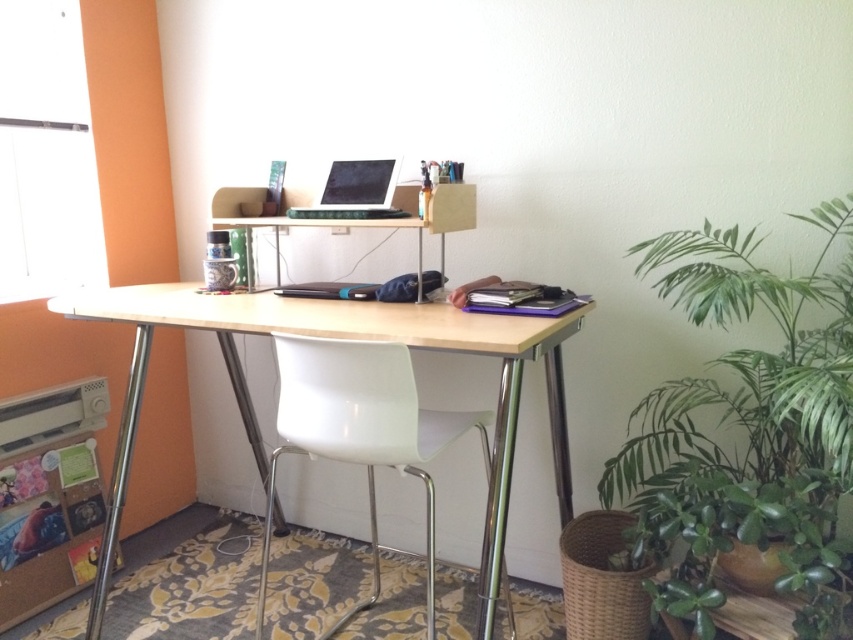
You are standing in front of the desk in the home office. Where is the green leafy plant at right located relative to your position?

The green leafy plant at right is located at point 0.669 on the x axis and 0.877 on the y axis relative to your position.